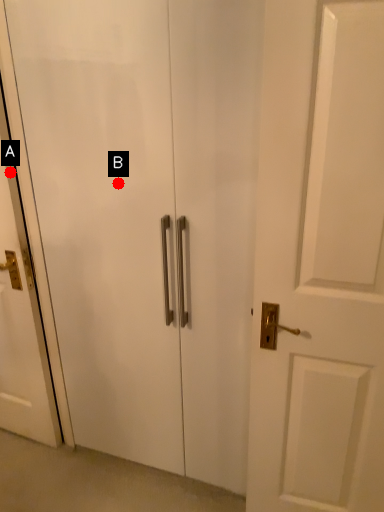
Question: Two points are circled on the image, labeled by A and B beside each circle. Which point is farther from the camera taking this photo?

Choices:
 (A) A is further
 (B) B is further

Answer: (A)